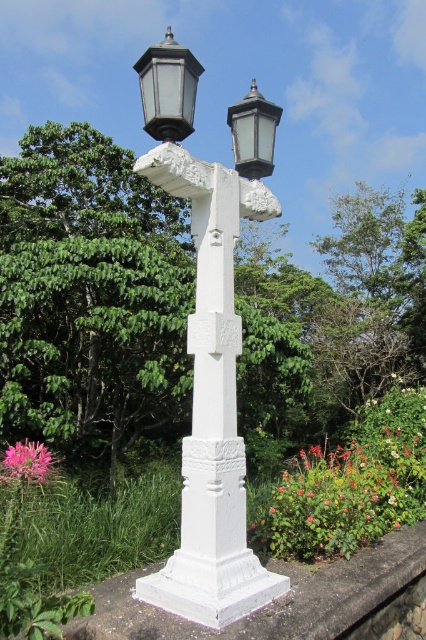
Between white stone street light at center and matte black lantern at upper right, which one has less height?

Standing shorter between the two is white stone street light at center.

Is point (219, 432) more distant than point (241, 138)?

That is False.

Find the location of a particular element. The image size is (426, 640). white stone street light at center is located at coordinates (210, 340).

Does point (250, 128) come closer to viewer compared to point (19, 451)?

No, it is behind (19, 451).

Is point (230, 579) closer to camera compared to point (34, 451)?

No, it is not.

Locate an element on the screen. The height and width of the screenshot is (640, 426). white stone street light at center is located at coordinates (210, 340).

Which is in front, point (146, 115) or point (279, 116)?

Point (146, 115) is in front.

Who is taller, matte black lantern at upper left or matte black lantern at upper right?

Standing taller between the two is matte black lantern at upper left.

Who is more forward, (147, 132) or (256, 172)?

Positioned in front is point (147, 132).

Find the location of a particular element. Image resolution: width=426 pixels, height=640 pixels. matte black lantern at upper left is located at coordinates (167, 88).